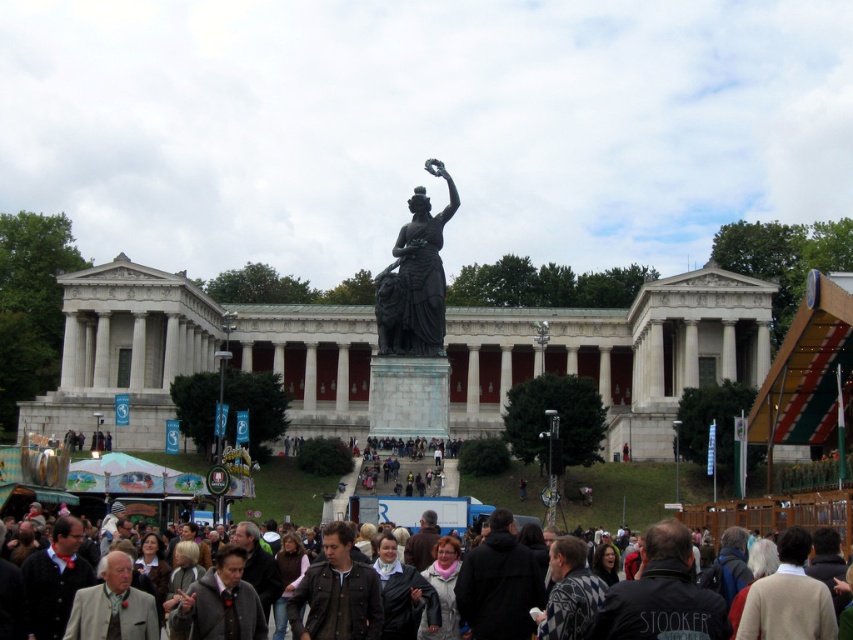
You are a photographer trying to capture a clear shot of the large bronze statue in front of the grand neoclassical building. However, there are two obstacles in your way. The first is the dark brown leather jacket at lower center and the second is the dark gray fabric crowd at center. Based on their sizes, which obstacle will block your view more significantly?

The dark brown leather jacket at lower center is bigger than the dark gray fabric crowd at center, so it will block your view more significantly.

You are standing at the entrance of the grand neoclassical building and want to find the dark brown leather jacket at lower center. According to the coordinates provided, where should you look relative to the entrance?

The dark brown leather jacket at lower center is located at coordinates point (814, 518), which would be near the bottom right corner of the image, so you should look towards the lower right area relative to the entrance.